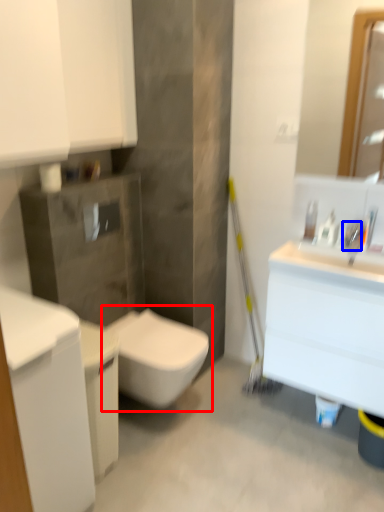
Question: Which object is further to the camera taking this photo, toilet (highlighted by a red box) or faucet (highlighted by a blue box)?

Choices:
 (A) toilet
 (B) faucet

Answer: (B)